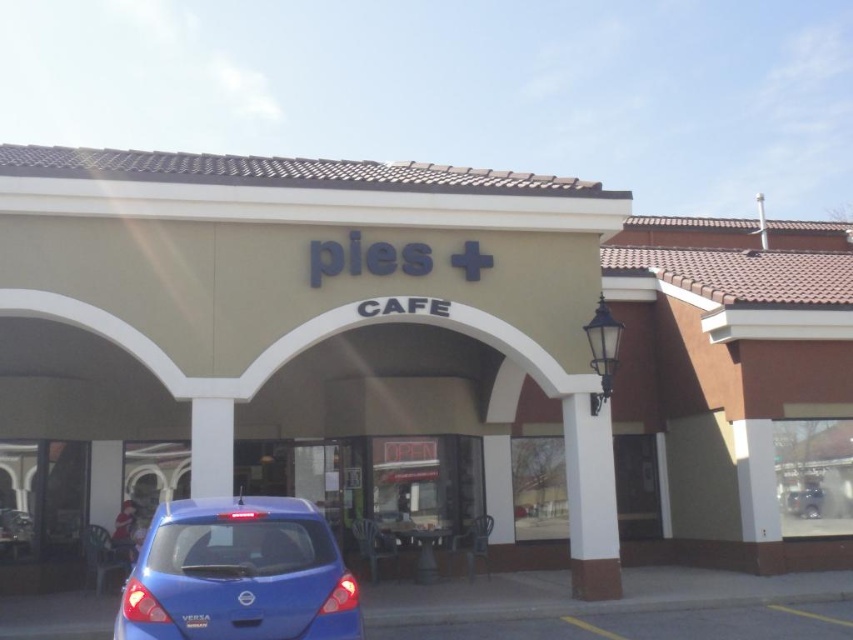
Does beige stucco cafe at center have a lesser height compared to blue glossy hatchback at lower left?

In fact, beige stucco cafe at center may be taller than blue glossy hatchback at lower left.

Is the position of beige stucco cafe at center more distant than that of blue glossy hatchback at lower left?

Yes, beige stucco cafe at center is further from the viewer.

Does point (258, 314) come behind point (287, 540)?

Yes, it is.

At what (x,y) coordinates should I click in order to perform the action: click on beige stucco cafe at center. Please return your answer as a coordinate pair (x, y). Looking at the image, I should click on (422, 358).